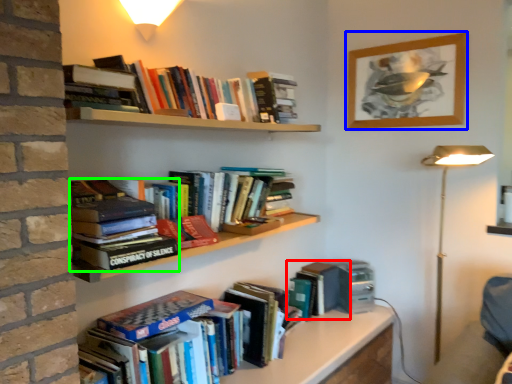
Question: Which is farther away from book (highlighted by a red box)? picture frame (highlighted by a blue box) or book (highlighted by a green box)?

Choices:
 (A) picture frame
 (B) book

Answer: (B)